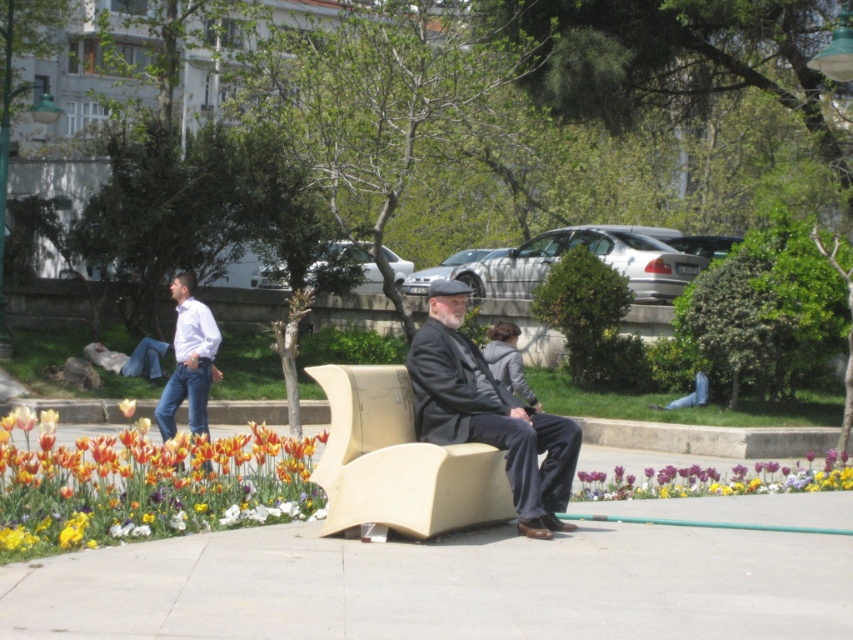
Question: Which point is farther to the camera?

Choices:
 (A) vivid purple petals at lower center
 (B) white shirt at left

Answer: (B)

Question: Which point is farther from the camera taking this photo?

Choices:
 (A) (680, 493)
 (B) (0, 556)

Answer: (A)

Question: Is beige wood armchair at center above vivid purple petals at lower center?

Choices:
 (A) no
 (B) yes

Answer: (B)

Question: Does vibrant tulip bed at lower left have a greater width compared to dark gray fabric coat at center?

Choices:
 (A) yes
 (B) no

Answer: (A)

Question: From the image, what is the correct spatial relationship of smooth concrete pavement at center in relation to white shirt at left?

Choices:
 (A) right
 (B) left

Answer: (A)

Question: Which point appears closest to the camera in this image?

Choices:
 (A) (120, 404)
 (B) (279, 620)
 (C) (199, 360)
 (D) (347, 406)

Answer: (B)